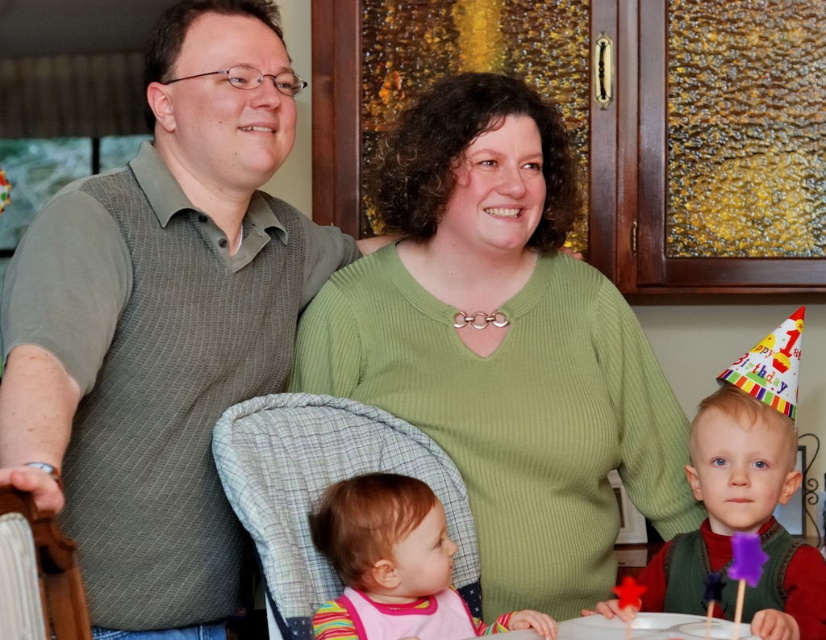
You are taking a photo of the birthday scene and notice two points marked in the image. The first point is at coordinate point[476,419] and the second is at point[328,488]. Which point is closer to the camera?

Point[476,419] is closer to the camera than point[328,488] because it is further to the camera than the second point.

You are standing in the kitchen and need to locate the green ribbed sweater at center. According to the coordinates provided, where exactly should you look to find it?

The green ribbed sweater at center is located at coordinates point (502,346).